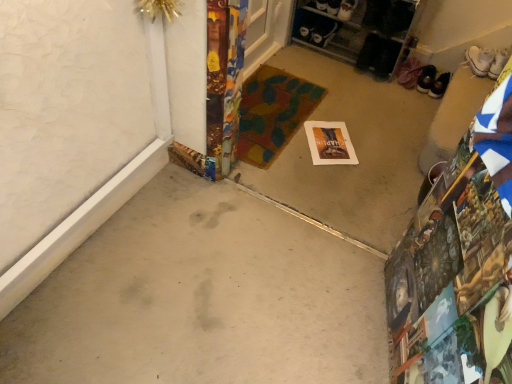
Question: Does gray concrete at center, the second concrete from the back, have a smaller size compared to black leather shoes at upper right, positioned as the second footwear in left-to-right order?

Choices:
 (A) yes
 (B) no

Answer: (B)

Question: From the image's perspective, is gray concrete at center, the second concrete from the back, located above black leather shoes at upper right, positioned as the second footwear in left-to-right order?

Choices:
 (A) yes
 (B) no

Answer: (B)

Question: Is gray concrete at center, marked as the 1th concrete in a front-to-back arrangement, positioned far away from black leather shoes at upper right, which ranks as the 2th footwear in right-to-left order?

Choices:
 (A) no
 (B) yes

Answer: (B)

Question: Is gray concrete at center, marked as the 1th concrete in a front-to-back arrangement, taller than black leather shoes at upper right, positioned as the second footwear in left-to-right order?

Choices:
 (A) yes
 (B) no

Answer: (B)

Question: Does gray concrete at center, the second concrete from the back, have a lesser height compared to black leather shoes at upper right, positioned as the second footwear in left-to-right order?

Choices:
 (A) no
 (B) yes

Answer: (B)

Question: Can you confirm if gray concrete at center, marked as the 1th concrete in a front-to-back arrangement, is wider than black leather shoes at upper right, which ranks as the 2th footwear in right-to-left order?

Choices:
 (A) no
 (B) yes

Answer: (B)

Question: Is black leather shoes at upper right, which is the third footwear in right-to-left order, further to the viewer compared to gray concrete at center, the second concrete from the back?

Choices:
 (A) no
 (B) yes

Answer: (B)

Question: Does black leather shoes at upper right, which is the third footwear in right-to-left order, lie in front of gray concrete at center, the second concrete from the back?

Choices:
 (A) no
 (B) yes

Answer: (A)

Question: From the image's perspective, would you say black leather shoes at upper right, which is the 1th footwear from left to right, is shown under gray concrete at center, marked as the 1th concrete in a front-to-back arrangement?

Choices:
 (A) no
 (B) yes

Answer: (A)

Question: Does black leather shoes at upper right, which is the third footwear in right-to-left order, have a lesser width compared to gray concrete at center, the second concrete from the back?

Choices:
 (A) no
 (B) yes

Answer: (B)

Question: Is black leather shoes at upper right, which is the 1th footwear from left to right, at the left side of gray concrete at center, marked as the 1th concrete in a front-to-back arrangement?

Choices:
 (A) yes
 (B) no

Answer: (B)

Question: Is black leather shoes at upper right, which is the 1th footwear from left to right, taller than gray concrete at center, marked as the 1th concrete in a front-to-back arrangement?

Choices:
 (A) yes
 (B) no

Answer: (A)

Question: Can you confirm if multicolored fabric doormat at center is bigger than white canvas sneakers at upper right, which is the first footwear in right-to-left order?

Choices:
 (A) no
 (B) yes

Answer: (B)